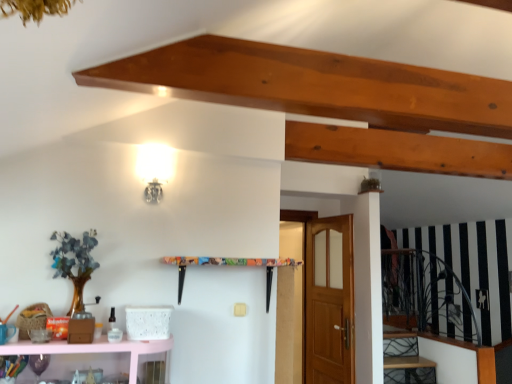
You are a GUI agent. You are given a task and a screenshot of the screen. Output one action in this format:
    pyautogui.click(x=<x>, y=<y>)
    Task: Click on the pink glossy shelf at lower left
    The height and width of the screenshot is (384, 512).
    Given the screenshot: What is the action you would take?
    pyautogui.click(x=93, y=349)

Locate an element on the screen. This screenshot has width=512, height=384. pink glossy shelf at lower left is located at coordinates (93, 349).

Which object is closer to the camera taking this photo, wooden stairwell at lower right or wooden door at center?

wooden door at center is more forward.

Considering the sizes of objects wooden stairwell at lower right and wooden door at center in the image provided, who is taller, wooden stairwell at lower right or wooden door at center?

Standing taller between the two is wooden door at center.

Is wooden door at center at the back of wooden stairwell at lower right?

That's not correct — wooden stairwell at lower right is not looking away from wooden door at center.

Considering the sizes of wooden stairwell at lower right and wooden door at center in the image, is wooden stairwell at lower right bigger or smaller than wooden door at center?

In the image, wooden stairwell at lower right appears to be smaller than wooden door at center.

Is wooden door at center located within pink glossy shelf at lower left?

Actually, wooden door at center is outside pink glossy shelf at lower left.

In the scene shown: Between pink glossy shelf at lower left and wooden door at center, which one has smaller width?

With smaller width is wooden door at center.

Does pink glossy shelf at lower left touch wooden door at center?

pink glossy shelf at lower left is not next to wooden door at center, and they're not touching.

Considering the relative sizes of wooden door at center and pink glossy shelf at lower left in the image provided, is wooden door at center thinner than pink glossy shelf at lower left?

Yes, wooden door at center is thinner than pink glossy shelf at lower left.

How much distance is there between wooden door at center and pink glossy shelf at lower left?

They are 6.36 feet apart.

Looking at the image, does wooden door at center seem bigger or smaller compared to pink glossy shelf at lower left?

Clearly, wooden door at center is larger in size than pink glossy shelf at lower left.

This screenshot has width=512, height=384. I want to click on shelf located in front of the wooden door at center, so click(93, 349).

Looking at this image, is wooden stairwell at lower right facing towards pink glossy shelf at lower left?

No, wooden stairwell at lower right is not aimed at pink glossy shelf at lower left.

Which is closer, (400, 355) or (132, 372)?

Point (400, 355).

From the image's perspective, is wooden stairwell at lower right above pink glossy shelf at lower left?

No, from the image's perspective, wooden stairwell at lower right is not over pink glossy shelf at lower left.

Based on the photo, does wooden stairwell at lower right have a greater width compared to pink glossy shelf at lower left?

Yes, wooden stairwell at lower right is wider than pink glossy shelf at lower left.

Is wooden door at center positioned with its back to wooden stairwell at lower right?

Yes.

Is point (336, 304) closer or farther from the camera than point (426, 363)?

Point (336, 304).

From a real-world perspective, which is physically above, wooden door at center or wooden stairwell at lower right?

From a 3D spatial view, wooden door at center is above.

Is wooden door at center far away from wooden stairwell at lower right?

Yes, wooden door at center and wooden stairwell at lower right are quite far apart.

Does pink glossy shelf at lower left turn towards wooden stairwell at lower right?

No, pink glossy shelf at lower left is not facing towards wooden stairwell at lower right.

Looking at this image, is pink glossy shelf at lower left positioned far away from wooden stairwell at lower right?

pink glossy shelf at lower left is positioned a significant distance from wooden stairwell at lower right.

From the image's perspective, which one is positioned lower, pink glossy shelf at lower left or wooden stairwell at lower right?

wooden stairwell at lower right, from the image's perspective.

This screenshot has width=512, height=384. Identify the location of door that appears above the wooden stairwell at lower right (from a real-world perspective). (329, 301).

Locate an element on the screen. Image resolution: width=512 pixels, height=384 pixels. door below the pink glossy shelf at lower left (from the image's perspective) is located at coordinates (329, 301).

Based on the photo, estimate the real-world distances between objects in this image. Which object is closer to wooden stairwell at lower right, wooden door at center or pink glossy shelf at lower left?

wooden door at center lies closer to wooden stairwell at lower right than the other object.

From the image, which object appears to be farther from pink glossy shelf at lower left, wooden door at center or wooden stairwell at lower right?

Based on the image, wooden stairwell at lower right appears to be further to pink glossy shelf at lower left.

Considering their positions, is wooden stairwell at lower right positioned closer to pink glossy shelf at lower left than wooden door at center?

wooden door at center is positioned closer to the anchor pink glossy shelf at lower left.

From the image, which object appears to be nearer to wooden door at center, wooden stairwell at lower right or pink glossy shelf at lower left?

The object closer to wooden door at center is wooden stairwell at lower right.

Looking at the image, which one is located further to wooden door at center, pink glossy shelf at lower left or wooden stairwell at lower right?

pink glossy shelf at lower left is further to wooden door at center.

Considering their positions, is pink glossy shelf at lower left positioned closer to wooden stairwell at lower right than wooden door at center?

wooden door at center is closer to wooden stairwell at lower right.

At what (x,y) coordinates should I click in order to perform the action: click on door located between pink glossy shelf at lower left and wooden stairwell at lower right in the left-right direction. Please return your answer as a coordinate pair (x, y). Looking at the image, I should click on (329, 301).